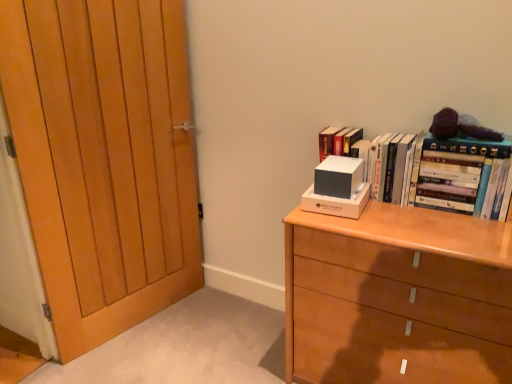
This screenshot has height=384, width=512. What are the coordinates of `vacant space in wooden door at left (from a real-world perspective)` in the screenshot? It's located at (143, 316).